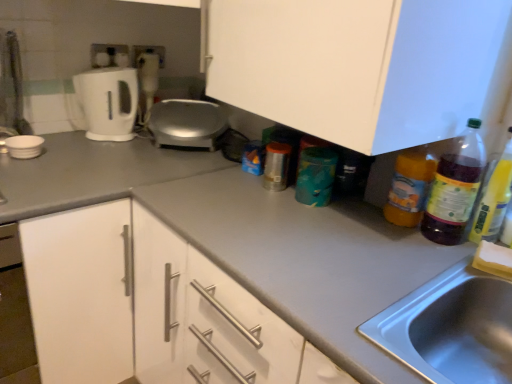
The height and width of the screenshot is (384, 512). What do you see at coordinates (148, 80) in the screenshot?
I see `white plastic blender at upper left` at bounding box center [148, 80].

This screenshot has width=512, height=384. Describe the element at coordinates (187, 123) in the screenshot. I see `satin silver appliance at center, placed as the second appliance when sorted from front to back` at that location.

What is the approximate width of white matte cabinet at center?

white matte cabinet at center is 20.25 inches in width.

Image resolution: width=512 pixels, height=384 pixels. I want to click on translucent plastic bottle at right, which appears as the 2th bottle when viewed from the right, so click(x=410, y=186).

Which is more to the right, gray matte countertop at center or white matte bowl at left, the second appliance in the back-to-front sequence?

gray matte countertop at center is more to the right.

Can you tell me how much gray matte countertop at center and white matte bowl at left, the second appliance in the back-to-front sequence, differ in facing direction?

The angular difference between gray matte countertop at center and white matte bowl at left, the second appliance in the back-to-front sequence, is 91.7 degrees.

Considering their positions, is gray matte countertop at center located in front of or behind white matte bowl at left, the first appliance in the left-to-right sequence?

Visually, gray matte countertop at center is located in front of white matte bowl at left, the first appliance in the left-to-right sequence.

Between point (285, 309) and point (29, 145), which one is positioned in front?

Positioned in front is point (285, 309).

Is translucent plastic bottle at right thinner than translucent plastic bottle at right, placed as the first bottle when sorted from left to right?

No.

How different are the orientations of translucent plastic bottle at right and translucent plastic bottle at right, which appears as the 2th bottle when viewed from the right, in degrees?

The angle between the facing direction of translucent plastic bottle at right and the facing direction of translucent plastic bottle at right, which appears as the 2th bottle when viewed from the right, is 3.42 degrees.

Between translucent plastic bottle at right and translucent plastic bottle at right, placed as the first bottle when sorted from left to right, which one has smaller size?

translucent plastic bottle at right, placed as the first bottle when sorted from left to right.

Is translucent plastic bottle at right beside translucent plastic bottle at right, placed as the first bottle when sorted from left to right?

Yes.

Is gray matte countertop at center inside or outside of translucent plastic bottle at right, which appears as the second bottle when viewed from the left?

gray matte countertop at center is not enclosed by translucent plastic bottle at right, which appears as the second bottle when viewed from the left.

Is gray matte countertop at center next to translucent plastic bottle at right, the 1th bottle viewed from the right, and touching it?

No, gray matte countertop at center is not touching translucent plastic bottle at right, the 1th bottle viewed from the right.

From the image's perspective, which object appears higher, gray matte countertop at center or translucent plastic bottle at right, the 1th bottle viewed from the right?

translucent plastic bottle at right, the 1th bottle viewed from the right, from the image's perspective.

Which of these two, gray matte countertop at center or translucent plastic bottle at right, which appears as the second bottle when viewed from the left, is bigger?

gray matte countertop at center is bigger.

From the image's perspective, which appliance is the 1st one above the translucent plastic bottle at right, which appears as the second bottle when viewed from the left? Please provide its 2D coordinates.

[(24, 146)]

Can you tell me how much translucent plastic bottle at right, which appears as the second bottle when viewed from the left, and white matte bowl at left, the first appliance in the left-to-right sequence, differ in facing direction?

90.3 degrees.

Which of these two, translucent plastic bottle at right, which appears as the second bottle when viewed from the left, or white matte bowl at left, which is the second appliance from right to left, is wider?

white matte bowl at left, which is the second appliance from right to left, is wider.

Considering the relative positions of translucent plastic bottle at right, the 1th bottle viewed from the right, and white matte bowl at left, the second appliance in the back-to-front sequence, in the image provided, is translucent plastic bottle at right, the 1th bottle viewed from the right, to the right of white matte bowl at left, the second appliance in the back-to-front sequence, from the viewer's perspective?

Yes, translucent plastic bottle at right, the 1th bottle viewed from the right, is to the right of white matte bowl at left, the second appliance in the back-to-front sequence.

From the picture: Considering the relative sizes of white plastic blender at upper left and translucent plastic bottle at right in the image provided, is white plastic blender at upper left smaller than translucent plastic bottle at right?

Yes, white plastic blender at upper left is smaller than translucent plastic bottle at right.

From the image's perspective, would you say white plastic blender at upper left is shown under translucent plastic bottle at right?

No, from the image's perspective, white plastic blender at upper left is not beneath translucent plastic bottle at right.

How many degrees apart are the facing directions of white plastic blender at upper left and translucent plastic bottle at right?

57.5 degrees.

From a real-world perspective, is white plastic blender at upper left under translucent plastic bottle at right?

Indeed, from a real-world perspective, white plastic blender at upper left is positioned beneath translucent plastic bottle at right.

How many degrees apart are the facing directions of white matte cabinet at center and gray matte countertop at center?

They differ by 1.75 degrees in their facing directions.

Is white matte cabinet at center located outside gray matte countertop at center?

That's correct, white matte cabinet at center is outside of gray matte countertop at center.

Is point (324, 24) positioned behind point (328, 306)?

Yes, point (324, 24) is behind point (328, 306).

Can you confirm if white matte cabinet at center is wider than gray matte countertop at center?

In fact, white matte cabinet at center might be narrower than gray matte countertop at center.

Are translucent plastic bottle at right, placed as the first bottle when sorted from left to right, and white matte bowl at left, the first appliance in the left-to-right sequence, making contact?

No.

Consider the image. Can you confirm if translucent plastic bottle at right, which appears as the 2th bottle when viewed from the right, is smaller than white matte bowl at left, the 1th appliance in the front-to-back sequence?

No.

From the image's perspective, is translucent plastic bottle at right, which appears as the 2th bottle when viewed from the right, below white matte bowl at left, the second appliance in the back-to-front sequence?

Yes, from the image's perspective, translucent plastic bottle at right, which appears as the 2th bottle when viewed from the right, is beneath white matte bowl at left, the second appliance in the back-to-front sequence.

From a real-world perspective, count 1st appliances upward from the gray matte countertop at center and point to it. Please provide its 2D coordinates.

[(24, 146)]

Where is `kitchen appliance on the right of translucent plastic bottle at right, which appears as the 2th bottle when viewed from the right`? This screenshot has width=512, height=384. kitchen appliance on the right of translucent plastic bottle at right, which appears as the 2th bottle when viewed from the right is located at coordinates (455, 187).

From the image, which object appears to be farther from satin silver appliance at center, the 1th appliance viewed from the right, translucent plastic bottle at right, which appears as the 2th bottle when viewed from the right, or white matte bowl at left, the first appliance in the left-to-right sequence?

translucent plastic bottle at right, which appears as the 2th bottle when viewed from the right, is further to satin silver appliance at center, the 1th appliance viewed from the right.

Looking at the image, which one is located closer to translucent plastic bottle at right, which appears as the second bottle when viewed from the left, white glossy electric kettle at upper left or translucent plastic bottle at right, which appears as the 2th bottle when viewed from the right?

The object closer to translucent plastic bottle at right, which appears as the second bottle when viewed from the left, is translucent plastic bottle at right, which appears as the 2th bottle when viewed from the right.

Estimate the real-world distances between objects in this image. Which object is further from white matte bowl at left, the first appliance in the left-to-right sequence, white glossy electric kettle at upper left or gray matte countertop at center?

gray matte countertop at center is positioned further to the anchor white matte bowl at left, the first appliance in the left-to-right sequence.

Based on their spatial positions, is white matte bowl at left, the 1th appliance in the front-to-back sequence, or white plastic blender at upper left further from satin silver appliance at center, placed as the second appliance when sorted from front to back?

white matte bowl at left, the 1th appliance in the front-to-back sequence, is positioned further to the anchor satin silver appliance at center, placed as the second appliance when sorted from front to back.

When comparing their distances from translucent plastic bottle at right, which appears as the second bottle when viewed from the left, does white glossy electric kettle at upper left or translucent plastic bottle at right seem further?

The object further to translucent plastic bottle at right, which appears as the second bottle when viewed from the left, is white glossy electric kettle at upper left.

Considering their positions, is white plastic blender at upper left positioned closer to white glossy electric kettle at upper left than translucent plastic bottle at right, which appears as the second bottle when viewed from the left?

white plastic blender at upper left.

Based on their spatial positions, is white matte bowl at left, the first appliance in the left-to-right sequence, or white plastic blender at upper left further from gray matte countertop at center?

white plastic blender at upper left is positioned further to the anchor gray matte countertop at center.

Which object lies nearer to the anchor point satin silver appliance at center, placed as the second appliance when sorted from front to back, white plastic blender at upper left or white matte bowl at left, the second appliance in the back-to-front sequence?

Among the two, white plastic blender at upper left is located nearer to satin silver appliance at center, placed as the second appliance when sorted from front to back.

Locate an element on the screen. kitchen appliance located between gray matte countertop at center and white plastic blender at upper left in the depth direction is located at coordinates (455, 187).

At what (x,y) coordinates should I click in order to perform the action: click on kitchen appliance situated between translucent plastic bottle at right, placed as the first bottle when sorted from left to right, and translucent plastic bottle at right, the 1th bottle viewed from the right, from left to right. Please return your answer as a coordinate pair (x, y). Looking at the image, I should click on (455, 187).

The height and width of the screenshot is (384, 512). I want to click on bottle located between white matte bowl at left, the second appliance in the back-to-front sequence, and translucent plastic bottle at right in the left-right direction, so click(x=410, y=186).

You are a GUI agent. You are given a task and a screenshot of the screen. Output one action in this format:
    pyautogui.click(x=<x>, y=<y>)
    Task: Click on the blender between white glossy electric kettle at upper left and satin silver appliance at center, the 1th appliance viewed from the right
    The width and height of the screenshot is (512, 384).
    Given the screenshot: What is the action you would take?
    pyautogui.click(x=148, y=80)